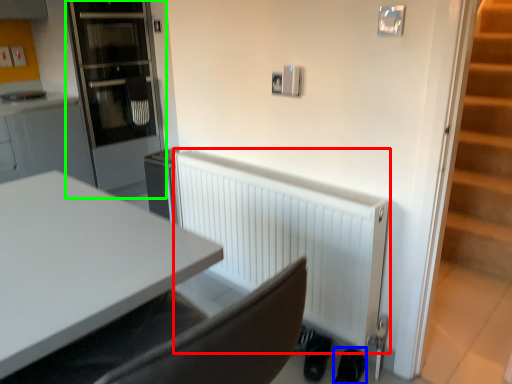
Question: Considering the real-world distances, which object is closest to radiator (highlighted by a red box)? shoe (highlighted by a blue box) or glass door (highlighted by a green box).

Choices:
 (A) shoe
 (B) glass door

Answer: (A)